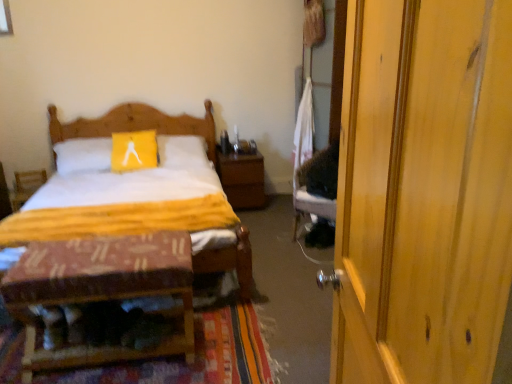
Question: Is textured woolen mat at lower left bigger or smaller than wooden door at right?

Choices:
 (A) big
 (B) small

Answer: (B)

Question: Choose the correct answer: Is textured woolen mat at lower left inside wooden door at right or outside it?

Choices:
 (A) outside
 (B) inside

Answer: (A)

Question: Considering the real-world distances, which object is closest to the wooden patterned stool at lower left?

Choices:
 (A) wooden nightstand at center
 (B) yellow cotton quilt at center
 (C) wooden armchair at left
 (D) wooden bed at center
 (E) textured woolen mat at lower left

Answer: (E)

Question: Which is farther from the wooden armchair at left?

Choices:
 (A) wooden patterned stool at lower left
 (B) wooden nightstand at center
 (C) textured woolen mat at lower left
 (D) wooden bed at center
 (E) yellow cotton quilt at center

Answer: (C)